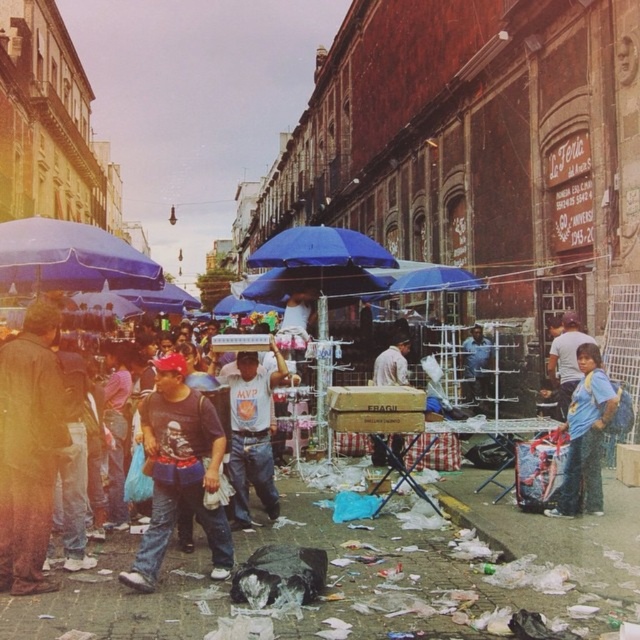
From the picture: You are a delivery person who needs to place a new package on the ground between the cardboard box at center and the dark blue jeans at center. Which object should you move to make space, and why?

The cardboard box at center has a larger width than the dark blue jeans at center. Therefore, you should move the cardboard box at center to create more space for the new package.